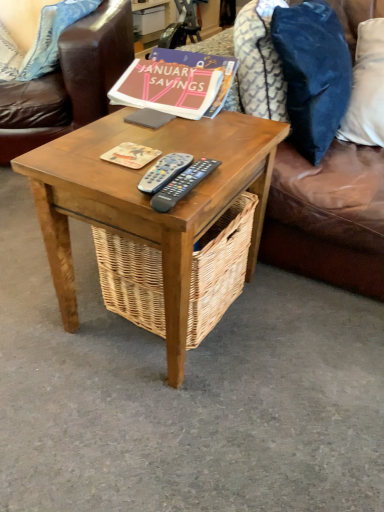
Image resolution: width=384 pixels, height=512 pixels. In order to click on free space to the left of matte cardboard coaster at center, the 2th book from the back in this screenshot , I will do `click(78, 152)`.